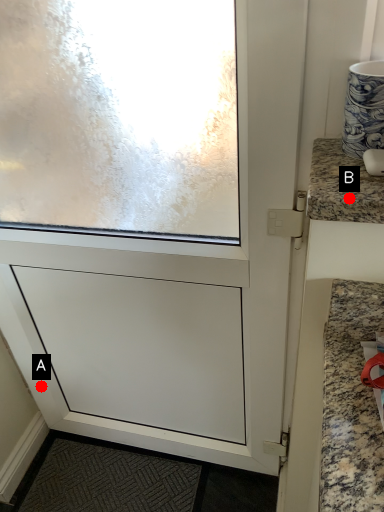
Question: Two points are circled on the image, labeled by A and B beside each circle. Which point is closer to the camera?

Choices:
 (A) A is closer
 (B) B is closer

Answer: (B)